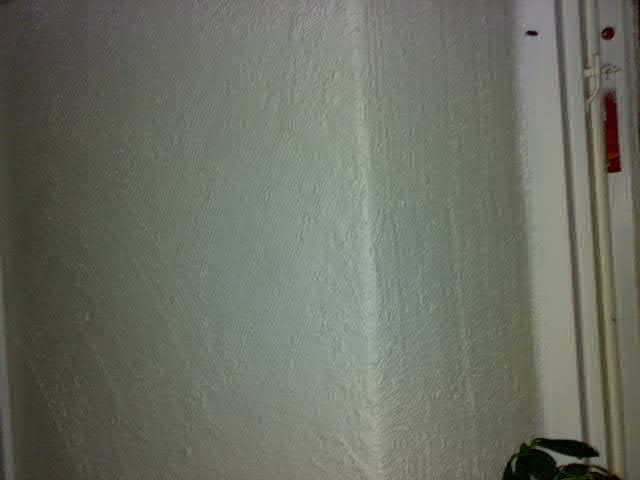
Identify the location of beginning of doorway. This screenshot has height=480, width=640. [x=636, y=11], [x=636, y=67].